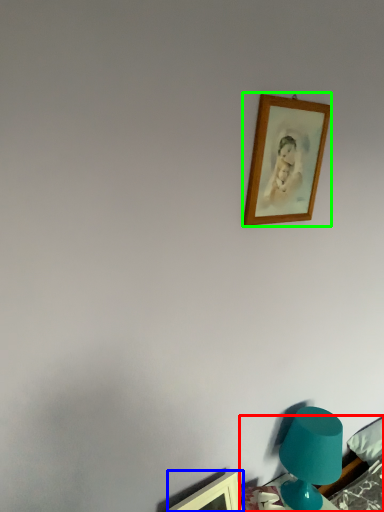
Question: Considering the real-world distances, which object is closest to furniture (highlighted by a red box)? picture frame (highlighted by a blue box) or picture frame (highlighted by a green box).

Choices:
 (A) picture frame
 (B) picture frame

Answer: (A)